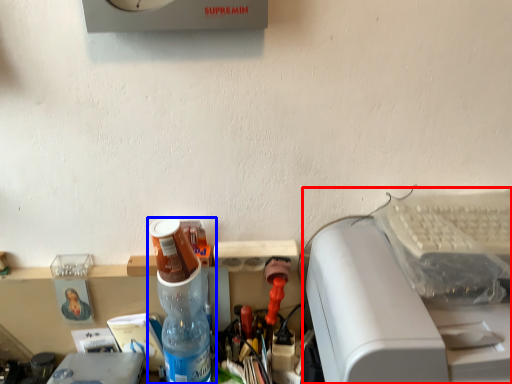
Question: Which object is further to the camera taking this photo, printer (highlighted by a red box) or bottle (highlighted by a blue box)?

Choices:
 (A) printer
 (B) bottle

Answer: (B)